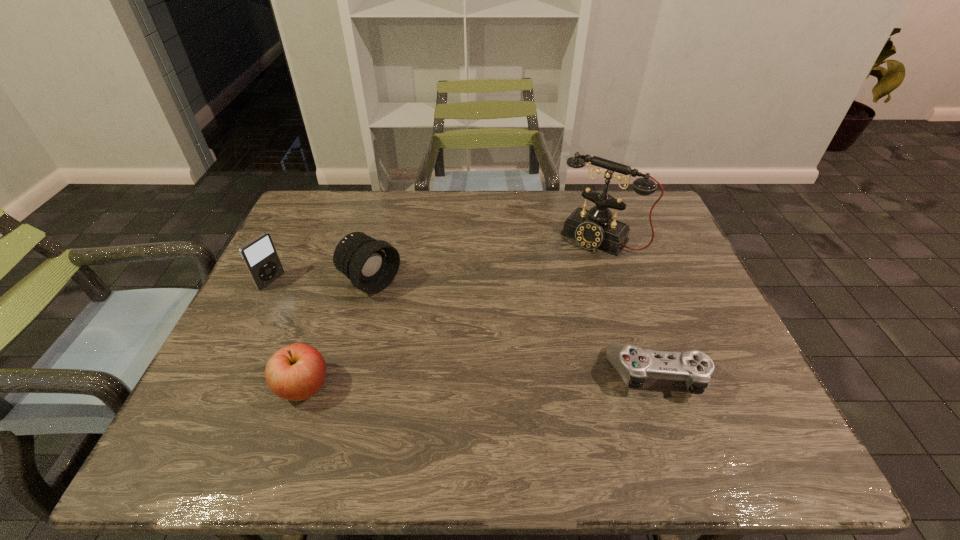
Where is `vacant space at the right edge`? The width and height of the screenshot is (960, 540). vacant space at the right edge is located at coordinates [667, 309].

Locate an element on the screen. The height and width of the screenshot is (540, 960). vacant position at the far left corner of the desktop is located at coordinates (321, 213).

The height and width of the screenshot is (540, 960). In order to click on vacant space at the near left corner of the desktop in this screenshot , I will do `click(228, 402)`.

In the image, there is a desktop. Where is `free space at the near right corner`? free space at the near right corner is located at coordinates (759, 392).

The width and height of the screenshot is (960, 540). Find the location of `vacant space that is in between the second shortest object and the tallest object`. vacant space that is in between the second shortest object and the tallest object is located at coordinates (451, 312).

Image resolution: width=960 pixels, height=540 pixels. What are the coordinates of `vacant area that lies between the telephone and the shortest object` in the screenshot? It's located at (629, 306).

This screenshot has width=960, height=540. Find the location of `free space between the leftmost object and the tallest object`. free space between the leftmost object and the tallest object is located at coordinates (435, 260).

Where is `vacant space in between the apple and the control`? Image resolution: width=960 pixels, height=540 pixels. vacant space in between the apple and the control is located at coordinates (480, 381).

You are a GUI agent. You are given a task and a screenshot of the screen. Output one action in this format:
    pyautogui.click(x=<x>, y=<y>)
    Task: Click on the empty space that is in between the shortest object and the iPod
    This screenshot has height=540, width=960.
    Given the screenshot: What is the action you would take?
    pyautogui.click(x=465, y=328)

This screenshot has width=960, height=540. Identify the location of free spot between the telephoto lens and the shortest object. (515, 328).